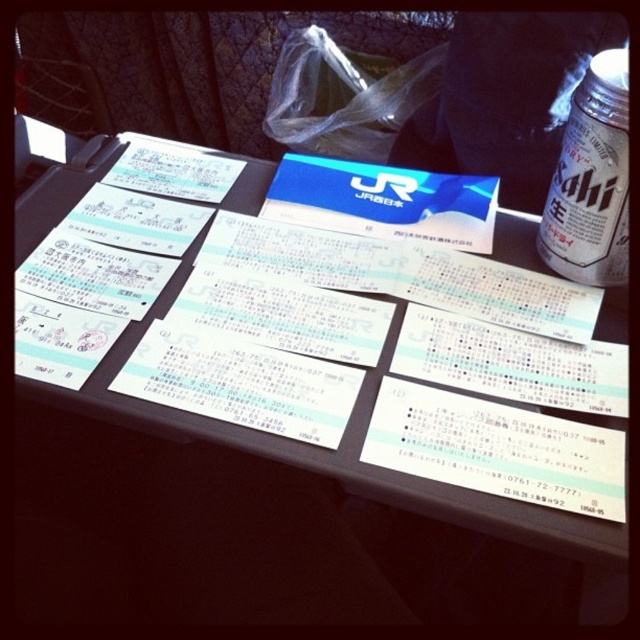
Question: Which of the following is the farthest from the observer?

Choices:
 (A) white paper tickets at center
 (B) white glass bottle at upper right

Answer: (B)

Question: Which point is closer to the camera taking this photo?

Choices:
 (A) pos(602,236)
 (B) pos(134,406)

Answer: (B)

Question: Does white paper tickets at center appear on the left side of white glass bottle at upper right?

Choices:
 (A) yes
 (B) no

Answer: (A)

Question: Does white paper tickets at center have a larger size compared to white glass bottle at upper right?

Choices:
 (A) yes
 (B) no

Answer: (A)

Question: Is white paper tickets at center behind white glass bottle at upper right?

Choices:
 (A) no
 (B) yes

Answer: (A)